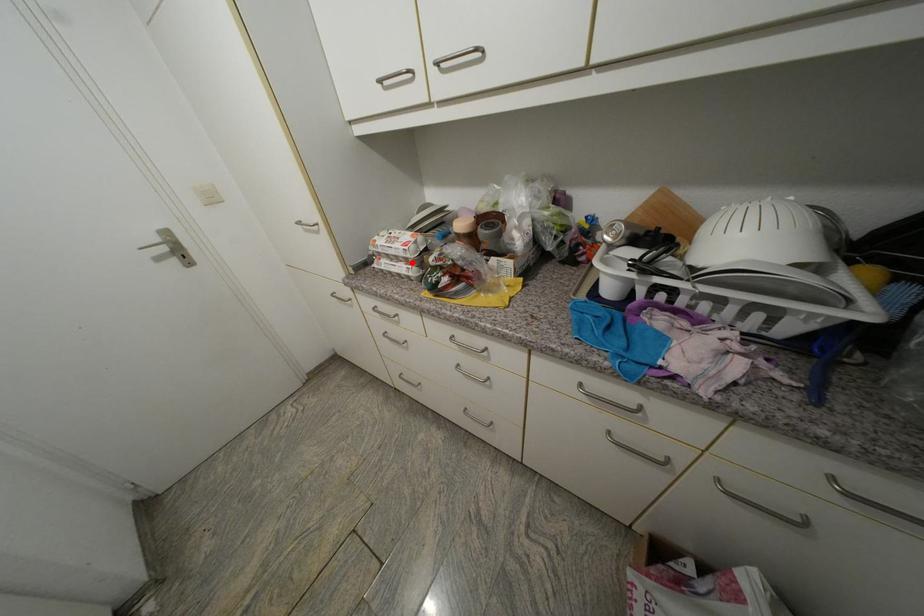
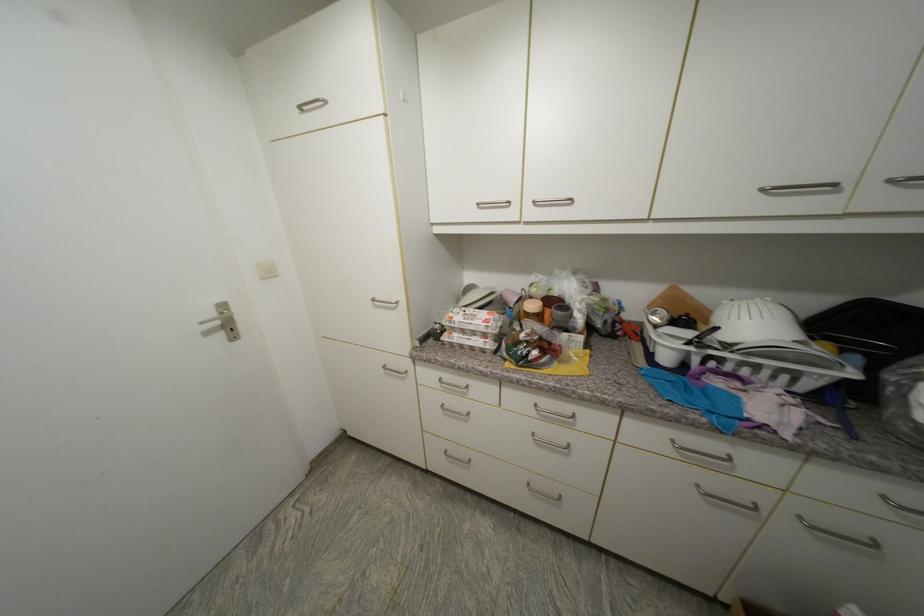
In the second image, find the point that corresponds to the highlighted location in the first image.

(490, 337)